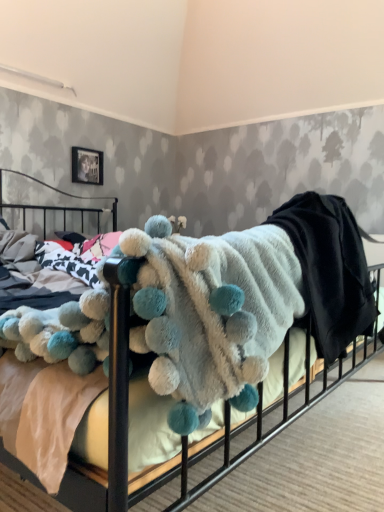
This screenshot has width=384, height=512. What do you see at coordinates (220, 284) in the screenshot?
I see `fluffy white blanket with blue pom-poms at center` at bounding box center [220, 284].

The image size is (384, 512). What do you see at coordinates (248, 300) in the screenshot? I see `fluffy white blanket at center` at bounding box center [248, 300].

At what (x,y) coordinates should I click in order to perform the action: click on fluffy white blanket with blue pom-poms at center. Please return your answer as a coordinate pair (x, y). The width and height of the screenshot is (384, 512). Looking at the image, I should click on (220, 284).

Is the depth of fluffy white blanket at center greater than that of fluffy white blanket with blue pom-poms at center?

Yes.

How many degrees apart are the facing directions of fluffy white blanket at center and fluffy white blanket with blue pom-poms at center?

There is a 5.54e-05-degree angle between the facing directions of fluffy white blanket at center and fluffy white blanket with blue pom-poms at center.

From a real-world perspective, relative to fluffy white blanket with blue pom-poms at center, is fluffy white blanket at center vertically above or below?

fluffy white blanket at center is above fluffy white blanket with blue pom-poms at center.

Would you say fluffy white blanket at center is a long distance from fluffy white blanket with blue pom-poms at center?

They are positioned close to each other.

Is fluffy white blanket with blue pom-poms at center oriented away from fluffy white blanket at center?

fluffy white blanket with blue pom-poms at center is not turned away from fluffy white blanket at center.

Which of these two, fluffy white blanket with blue pom-poms at center or fluffy white blanket at center, stands shorter?

fluffy white blanket with blue pom-poms at center.

From a real-world perspective, relative to fluffy white blanket at center, is fluffy white blanket with blue pom-poms at center vertically above or below?

In terms of real-world spatial position, fluffy white blanket with blue pom-poms at center is below fluffy white blanket at center.

Find the location of a particular element. baby clothe on the right of metallic silver picture frame at upper left is located at coordinates (248, 300).

Is metallic silver picture frame at upper left to the right of fluffy white blanket at center from the viewer's perspective?

Incorrect, metallic silver picture frame at upper left is not on the right side of fluffy white blanket at center.

Considering the relative positions of metallic silver picture frame at upper left and fluffy white blanket at center in the image provided, is metallic silver picture frame at upper left behind fluffy white blanket at center?

Yes, metallic silver picture frame at upper left is behind fluffy white blanket at center.

Does metallic silver picture frame at upper left have a lesser height compared to fluffy white blanket at center?

Yes, metallic silver picture frame at upper left is shorter than fluffy white blanket at center.

Is fluffy white blanket at center not near metallic silver picture frame at upper left?

Answer: Yes, fluffy white blanket at center is far from metallic silver picture frame at upper left.

Considering their positions, is fluffy white blanket at center located in front of or behind metallic silver picture frame at upper left?

fluffy white blanket at center is positioned closer to the viewer than metallic silver picture frame at upper left.

In the image, there is a fluffy white blanket at center. Where is `picture frame above it (from the image's perspective)`? The height and width of the screenshot is (512, 384). picture frame above it (from the image's perspective) is located at coordinates (87, 166).

Which is in front, metallic silver picture frame at upper left or fluffy white blanket with blue pom-poms at center?

fluffy white blanket with blue pom-poms at center is in front.

Which of these two, metallic silver picture frame at upper left or fluffy white blanket with blue pom-poms at center, stands taller?

Standing taller between the two is fluffy white blanket with blue pom-poms at center.

Consider the image. From the image's perspective, relative to fluffy white blanket with blue pom-poms at center, is metallic silver picture frame at upper left above or below?

Based on their image positions, metallic silver picture frame at upper left is located above fluffy white blanket with blue pom-poms at center.

Locate an element on the screen. picture frame above the fluffy white blanket with blue pom-poms at center (from the image's perspective) is located at coordinates (87, 166).

Do you think fluffy white blanket with blue pom-poms at center is within metallic silver picture frame at upper left, or outside of it?

fluffy white blanket with blue pom-poms at center lies outside metallic silver picture frame at upper left.

Does fluffy white blanket with blue pom-poms at center have a larger size compared to metallic silver picture frame at upper left?

Yes, fluffy white blanket with blue pom-poms at center is bigger than metallic silver picture frame at upper left.

Is fluffy white blanket with blue pom-poms at center taller than metallic silver picture frame at upper left?

Yes, fluffy white blanket with blue pom-poms at center is taller than metallic silver picture frame at upper left.

There is a fluffy white blanket with blue pom-poms at center. What are the coordinates of `baby clothe above it (from a real-world perspective)` in the screenshot? It's located at (248, 300).

You are a GUI agent. You are given a task and a screenshot of the screen. Output one action in this format:
    pyautogui.click(x=<x>, y=<y>)
    Task: Click on the bed in front of the fluffy white blanket at center
    The width and height of the screenshot is (384, 512).
    Given the screenshot: What is the action you would take?
    pyautogui.click(x=220, y=284)

When comparing their distances from fluffy white blanket with blue pom-poms at center, does metallic silver picture frame at upper left or fluffy white blanket at center seem further?

metallic silver picture frame at upper left is positioned further to the anchor fluffy white blanket with blue pom-poms at center.

Considering their positions, is fluffy white blanket with blue pom-poms at center positioned closer to metallic silver picture frame at upper left than fluffy white blanket at center?

Among the two, fluffy white blanket at center is located nearer to metallic silver picture frame at upper left.

From the image, which object appears to be nearer to fluffy white blanket with blue pom-poms at center, fluffy white blanket at center or metallic silver picture frame at upper left?

fluffy white blanket at center.

Looking at the image, which one is located further to fluffy white blanket at center, metallic silver picture frame at upper left or fluffy white blanket with blue pom-poms at center?

metallic silver picture frame at upper left.

When comparing their distances from metallic silver picture frame at upper left, does fluffy white blanket at center or fluffy white blanket with blue pom-poms at center seem closer?

Based on the image, fluffy white blanket at center appears to be nearer to metallic silver picture frame at upper left.

Based on their spatial positions, is fluffy white blanket with blue pom-poms at center or metallic silver picture frame at upper left further from fluffy white blanket at center?

Based on the image, metallic silver picture frame at upper left appears to be further to fluffy white blanket at center.

I want to click on baby clothe between fluffy white blanket with blue pom-poms at center and metallic silver picture frame at upper left in the front-back direction, so click(x=248, y=300).